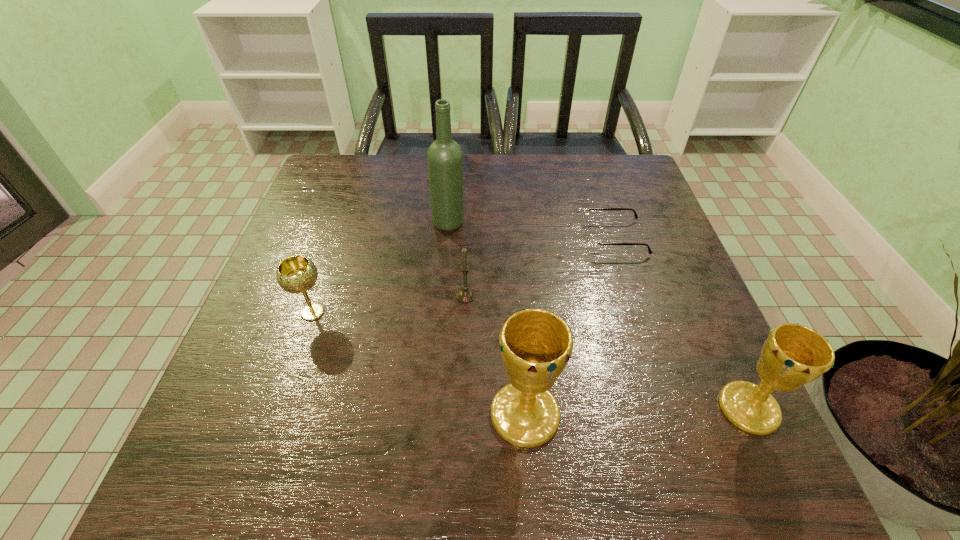
Identify the location of the third object from right to left. (536, 344).

This screenshot has width=960, height=540. In order to click on the fifth shortest object in this screenshot , I will do `click(536, 344)`.

Find the location of a particular element. The width and height of the screenshot is (960, 540). the rightmost object is located at coordinates (793, 355).

Where is `the fourth shortest object`? the fourth shortest object is located at coordinates (793, 355).

Image resolution: width=960 pixels, height=540 pixels. In order to click on wine bottle in this screenshot , I will do `click(445, 158)`.

Locate an element on the screen. This screenshot has height=540, width=960. spectacles is located at coordinates (595, 240).

At what (x,y) coordinates should I click in order to perform the action: click on the fifth object from left to right. Please return your answer as a coordinate pair (x, y). Looking at the image, I should click on (595, 240).

At what (x,y) coordinates should I click in order to perform the action: click on the farthest chalice. Please return your answer as a coordinate pair (x, y). This screenshot has height=540, width=960. Looking at the image, I should click on (296, 274).

Locate an element on the screen. the leftmost object is located at coordinates (296, 274).

Where is `candle`? The width and height of the screenshot is (960, 540). candle is located at coordinates (465, 295).